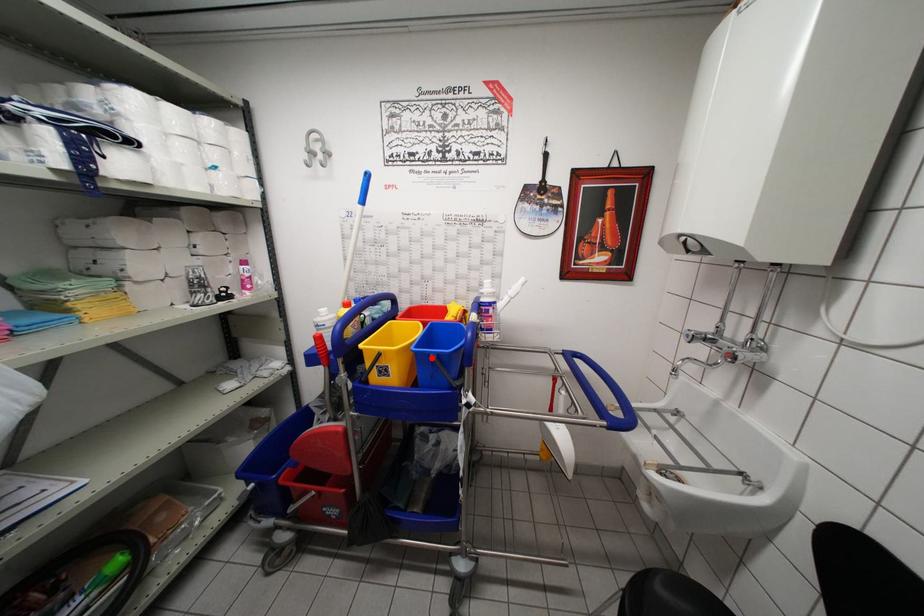
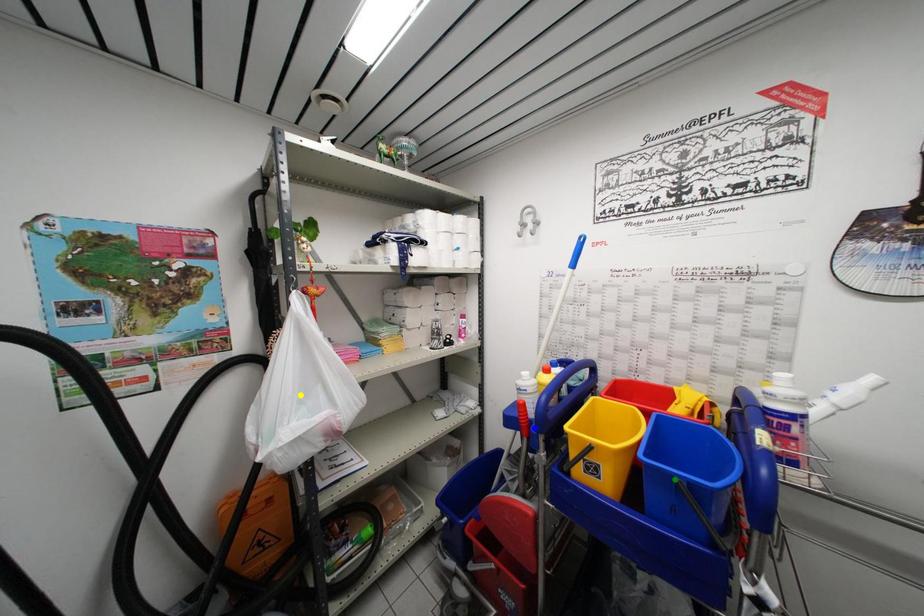
Question: I am providing you with two images of the same scene from different viewpoints. A red point is marked on the first image. You are given multiple points on the second image. Which spot in image 2 lines up with the point in image 1?

Choices:
 (A) yellow point
 (B) blue point
 (C) green point

Answer: (C)